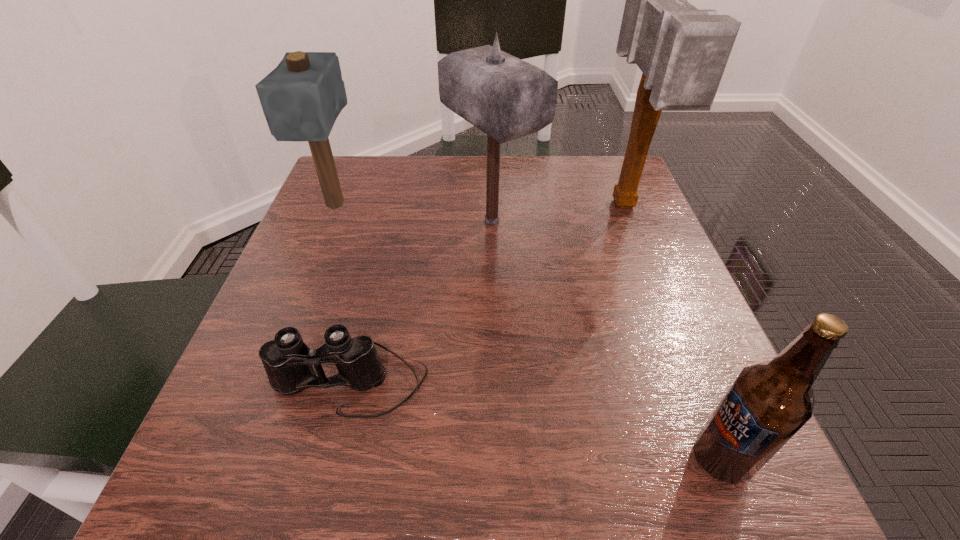
Where is `object that stands as the second closest to the beer bottle`? Image resolution: width=960 pixels, height=540 pixels. object that stands as the second closest to the beer bottle is located at coordinates (682, 51).

Identify which mallet is located as the second nearest to the second mallet from left to right. Please provide its 2D coordinates. Your answer should be formatted as a tuple, i.e. [(x, y)], where the tuple contains the x and y coordinates of a point satisfying the conditions above.

[(301, 98)]

I want to click on mallet that is the closest to the third object from left to right, so click(682, 51).

You are a GUI agent. You are given a task and a screenshot of the screen. Output one action in this format:
    pyautogui.click(x=<x>, y=<y>)
    Task: Click on the free space that satisfies the following two spatial constraints: 1. on the back side of the rightmost mallet; 2. on the left side of the third object from right to left
    
    Given the screenshot: What is the action you would take?
    pyautogui.click(x=492, y=206)

Where is `blank space that satisfies the following two spatial constraints: 1. on the back side of the third object from right to left; 2. on the right side of the binoculars`? The height and width of the screenshot is (540, 960). blank space that satisfies the following two spatial constraints: 1. on the back side of the third object from right to left; 2. on the right side of the binoculars is located at coordinates (390, 220).